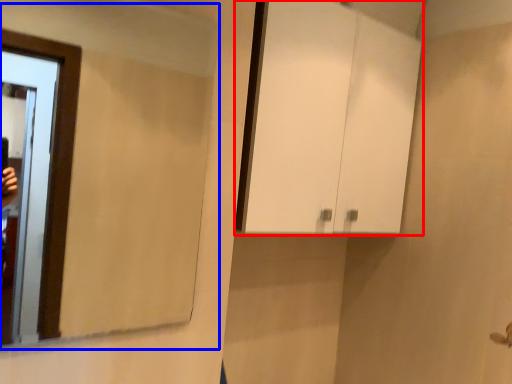
Question: Which of the following is the closest to the observer, cabinetry (highlighted by a red box) or mirror (highlighted by a blue box)?

Choices:
 (A) cabinetry
 (B) mirror

Answer: (B)